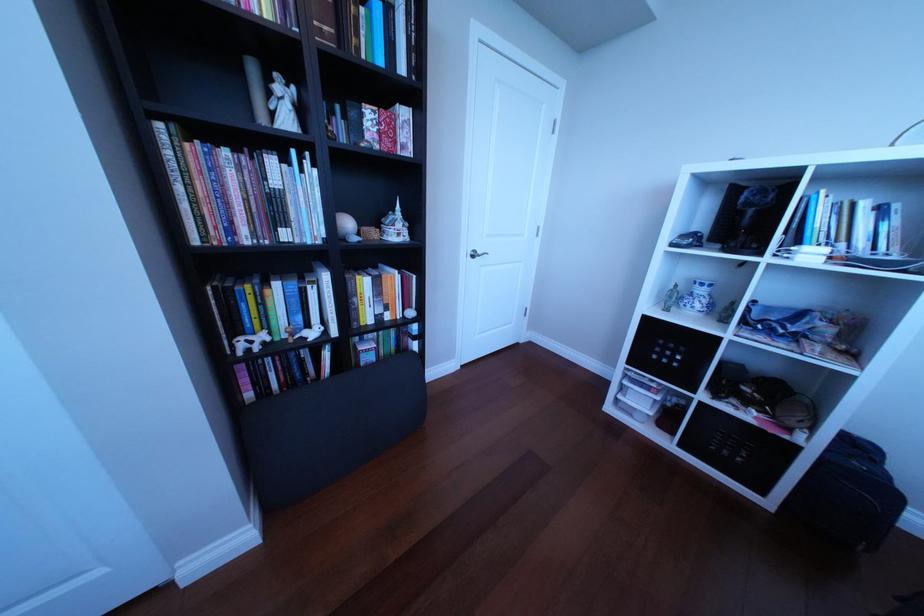
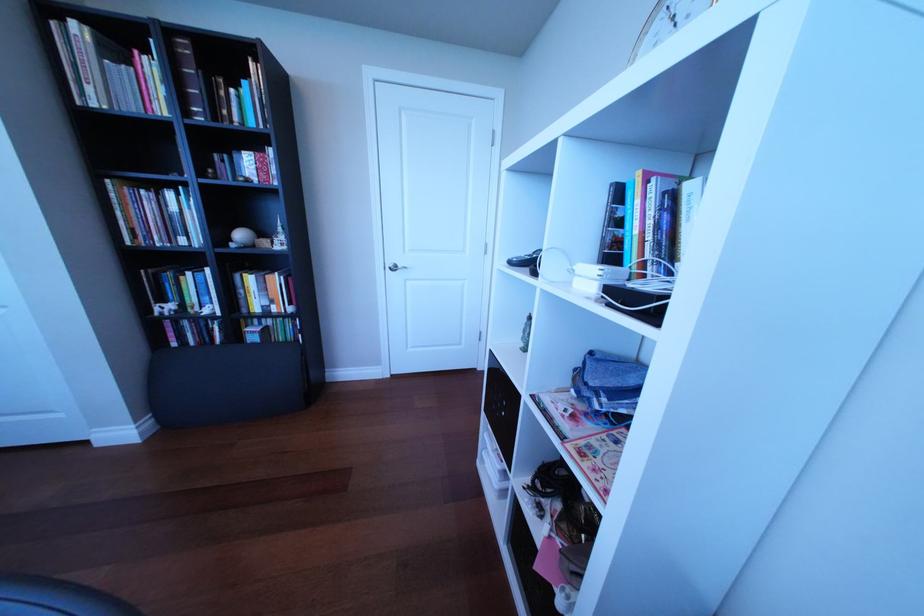
Question: In a continuous first-person perspective shot, in which direction is the camera moving?

Choices:
 (A) Left
 (B) Right
 (C) Forward
 (D) Backward

Answer: (B)